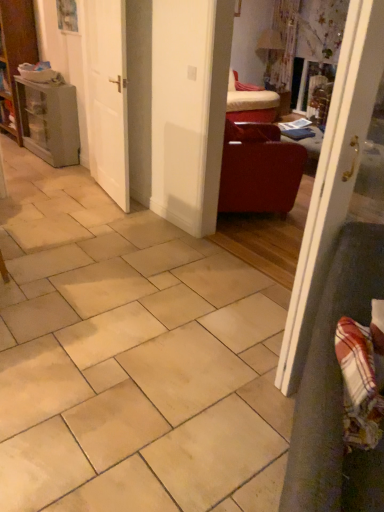
Question: Relative to matte leather armchair at center-right, is plaid fabric armchair at lower right in front or behind?

Choices:
 (A) behind
 (B) front

Answer: (B)

Question: From a real-world perspective, is plaid fabric armchair at lower right physically located above or below matte leather armchair at center-right?

Choices:
 (A) below
 (B) above

Answer: (B)

Question: Which object is the closest to the white glossy door at right, placed as the 1th door when sorted from right to left?

Choices:
 (A) plaid fabric armchair at lower right
 (B) matte gray cabinet at left
 (C) beige ceramic tile at center
 (D) matte leather armchair at center-right
 (E) white matte door at center, arranged as the 2th door when viewed from the front

Answer: (A)

Question: Considering the real-world distances, which object is farthest from the matte leather armchair at center-right?

Choices:
 (A) white glossy door at right, acting as the second door starting from the left
 (B) white matte door at center, the 1th door when ordered from left to right
 (C) matte gray cabinet at left
 (D) plaid fabric armchair at lower right
 (E) beige ceramic tile at center

Answer: (C)